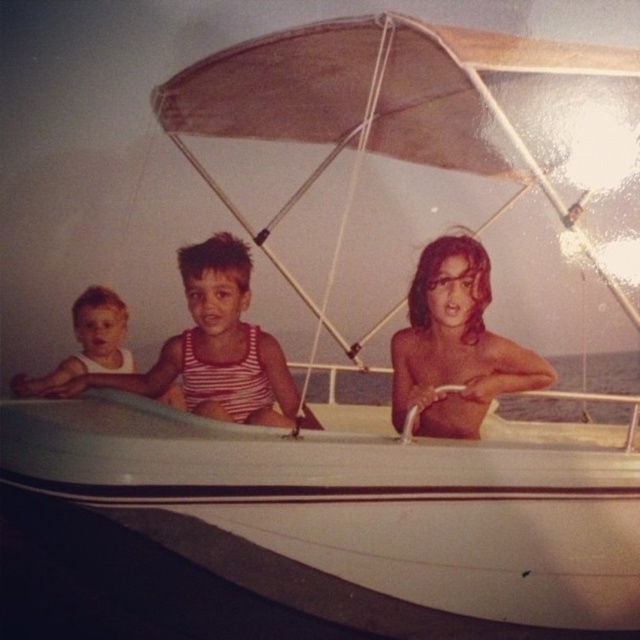
Between shiny skin at center and white matte tank top at left, which one appears on the left side from the viewer's perspective?

white matte tank top at left

What do you see at coordinates (454, 344) in the screenshot?
I see `shiny skin at center` at bounding box center [454, 344].

Does point (476, 385) come closer to viewer compared to point (124, 355)?

Yes, point (476, 385) is closer to viewer.

Locate an element on the screen. This screenshot has width=640, height=640. shiny skin at center is located at coordinates (454, 344).

Does shiny skin at center lie behind white striped tank top at center?

Yes.

Does point (397, 378) come closer to viewer compared to point (240, 337)?

No, (397, 378) is behind (240, 337).

The height and width of the screenshot is (640, 640). In order to click on shiny skin at center in this screenshot , I will do `click(454, 344)`.

Locate an element on the screen. shiny skin at center is located at coordinates (454, 344).

Who is positioned more to the left, white striped tank top at center or white matte tank top at left?

Positioned to the left is white matte tank top at left.

The width and height of the screenshot is (640, 640). What do you see at coordinates (216, 346) in the screenshot?
I see `white striped tank top at center` at bounding box center [216, 346].

Between point (232, 417) and point (93, 362), which one is positioned in front?

Positioned in front is point (232, 417).

This screenshot has height=640, width=640. Find the location of `white striped tank top at center`. white striped tank top at center is located at coordinates (216, 346).